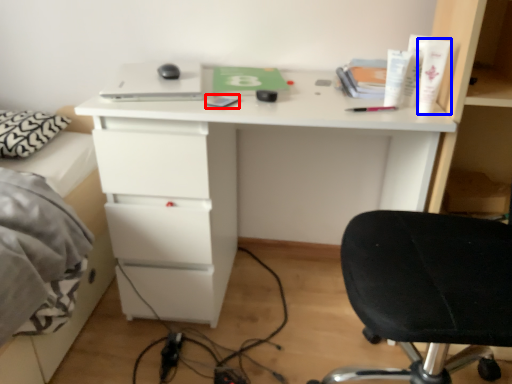
Question: Which point is closer to the camera, notepad (highlighted by a red box) or toiletry (highlighted by a blue box)?

Choices:
 (A) notepad
 (B) toiletry

Answer: (B)